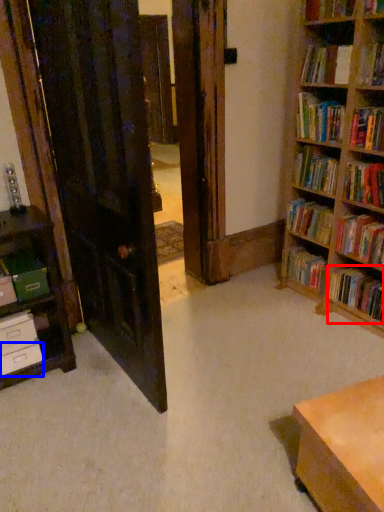
Question: Among these objects, which one is nearest to the camera, book (highlighted by a red box) or drawer (highlighted by a blue box)?

Choices:
 (A) book
 (B) drawer

Answer: (B)